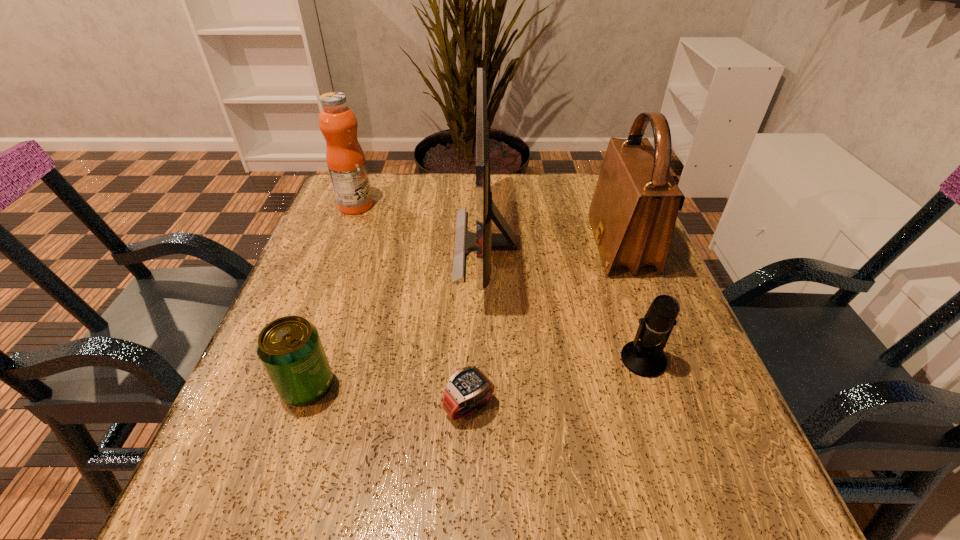
Image resolution: width=960 pixels, height=540 pixels. In the image, there is a desktop. Identify the location of vacant space at the far right corner. (572, 175).

This screenshot has height=540, width=960. What are the coordinates of `vacant point located between the monitor and the fruit juice` in the screenshot? It's located at (420, 225).

The image size is (960, 540). I want to click on free area in between the fruit juice and the monitor, so click(420, 225).

This screenshot has width=960, height=540. What are the coordinates of `free point between the monitor and the microphone` in the screenshot? It's located at (564, 302).

This screenshot has width=960, height=540. I want to click on vacant area that lies between the microphone and the fruit juice, so click(499, 282).

This screenshot has width=960, height=540. What are the coordinates of `free spot between the shoulder bag and the monitor` in the screenshot? It's located at pos(553,245).

Where is `vacant space in between the beer can and the monitor`? The height and width of the screenshot is (540, 960). vacant space in between the beer can and the monitor is located at coordinates (396, 315).

I want to click on free space between the shortest object and the microphone, so click(556, 383).

At what (x,y) coordinates should I click in order to perform the action: click on vacant area that lies between the monitor and the microphone. Please return your answer as a coordinate pair (x, y). Looking at the image, I should click on (564, 302).

The height and width of the screenshot is (540, 960). I want to click on free area in between the fruit juice and the shortest object, so click(x=413, y=306).